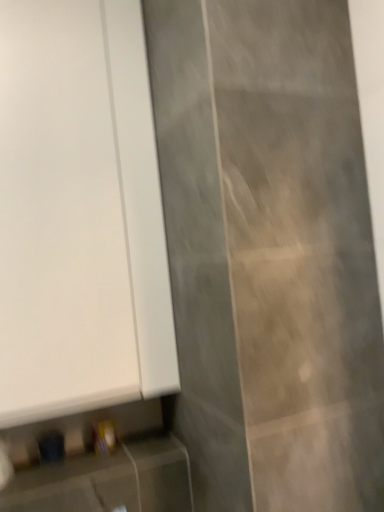
Question: Relative to white matte door at upper left, is matte white cabinet at lower left in front or behind?

Choices:
 (A) behind
 (B) front

Answer: (B)

Question: Looking at their shapes, would you say matte white cabinet at lower left is wider or thinner than white matte door at upper left?

Choices:
 (A) wide
 (B) thin

Answer: (A)

Question: Is point click(x=180, y=510) positioned closer to the camera than point click(x=46, y=220)?

Choices:
 (A) closer
 (B) farther

Answer: (B)

Question: In the image, is white matte door at upper left on the left side or the right side of matte white cabinet at lower left?

Choices:
 (A) left
 (B) right

Answer: (A)

Question: Considering the positions of white matte door at upper left and matte white cabinet at lower left in the image, is white matte door at upper left wider or thinner than matte white cabinet at lower left?

Choices:
 (A) thin
 (B) wide

Answer: (A)

Question: From the image's perspective, is white matte door at upper left positioned above or below matte white cabinet at lower left?

Choices:
 (A) above
 (B) below

Answer: (A)

Question: Would you say white matte door at upper left is inside or outside matte white cabinet at lower left?

Choices:
 (A) inside
 (B) outside

Answer: (B)